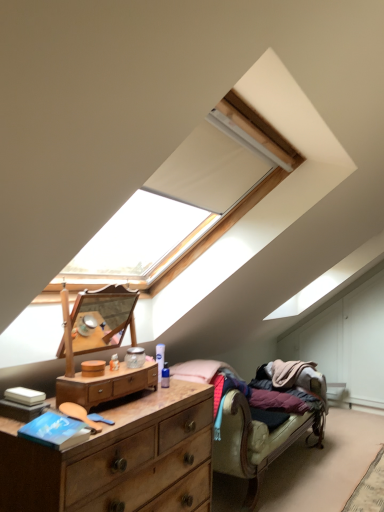
Question: Considering the positions of wooden studio couch at lower right and wooden dresser at lower left, acting as the first chest of drawers starting from the bottom, in the image, is wooden studio couch at lower right taller or shorter than wooden dresser at lower left, acting as the first chest of drawers starting from the bottom,?

Choices:
 (A) tall
 (B) short

Answer: (A)

Question: Is wooden studio couch at lower right wider or thinner than wooden dresser at lower left, which is counted as the second chest of drawers, starting from the top?

Choices:
 (A) thin
 (B) wide

Answer: (B)

Question: Considering the real-world distances, which object is farthest from the wooden dresser at lower left, which is counted as the second chest of drawers, starting from the top?

Choices:
 (A) wooden dresser at center, which is the second chest of drawers in bottom-to-top order
 (B) wooden studio couch at lower right

Answer: (B)

Question: Considering the real-world distances, which object is farthest from the wooden dresser at center, acting as the 1th chest of drawers starting from the top?

Choices:
 (A) wooden dresser at lower left, acting as the first chest of drawers starting from the bottom
 (B) wooden studio couch at lower right

Answer: (B)